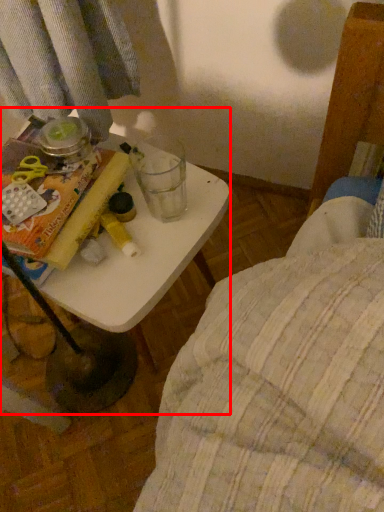
Question: From the image's perspective, what is the correct spatial relationship of table (annotated by the red box) in relation to paperback book?

Choices:
 (A) below
 (B) above

Answer: (A)